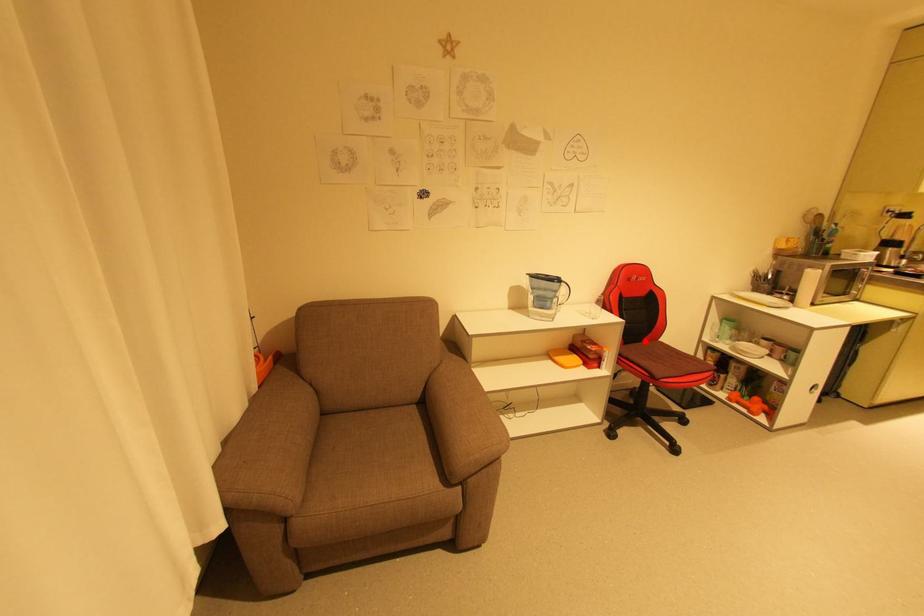
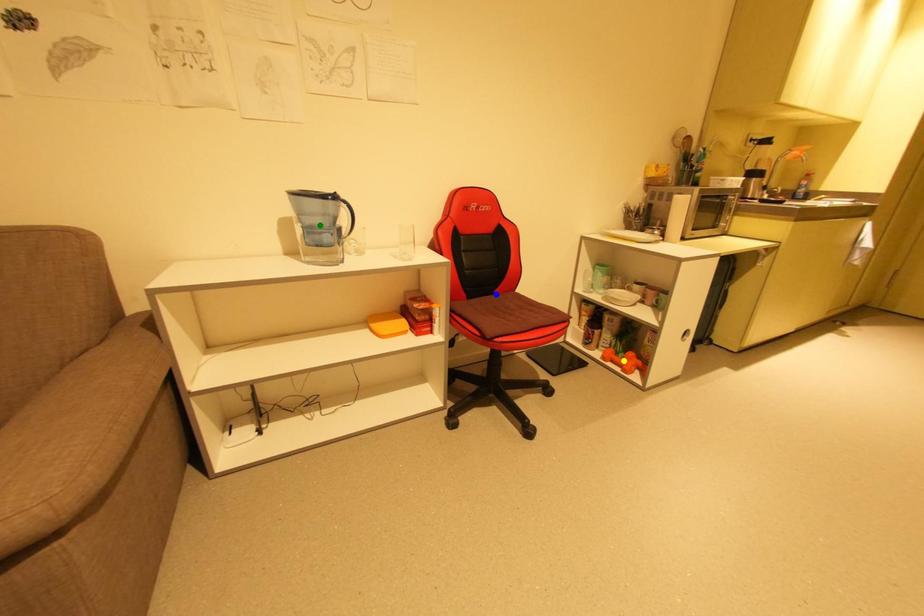
Question: I am providing you with two images of the same scene from different viewpoints. A red point is marked on the first image. You are given multiple points on the second image. Which point in image 2 represents the same 3d spot as the red point in image 1?

Choices:
 (A) yellow point
 (B) blue point
 (C) green point

Answer: (B)